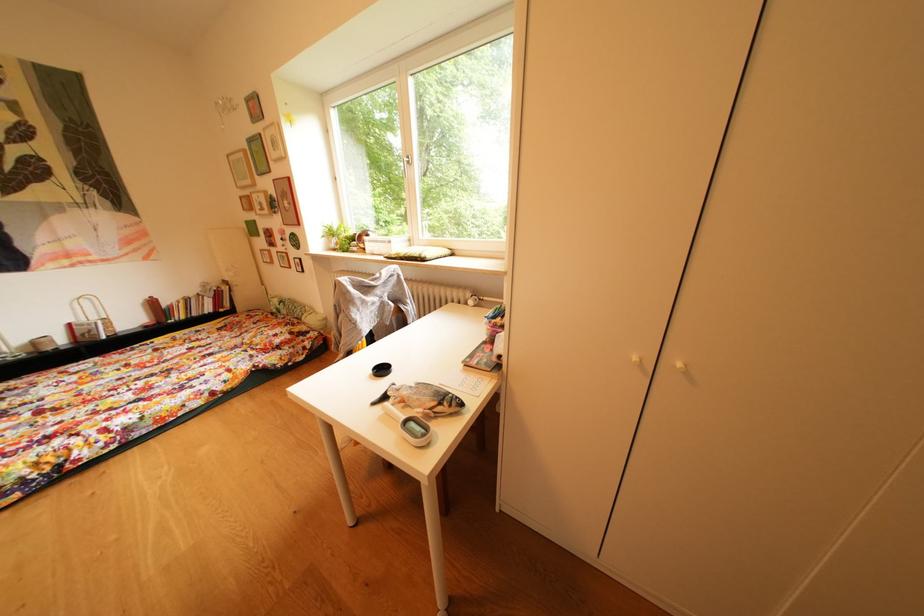
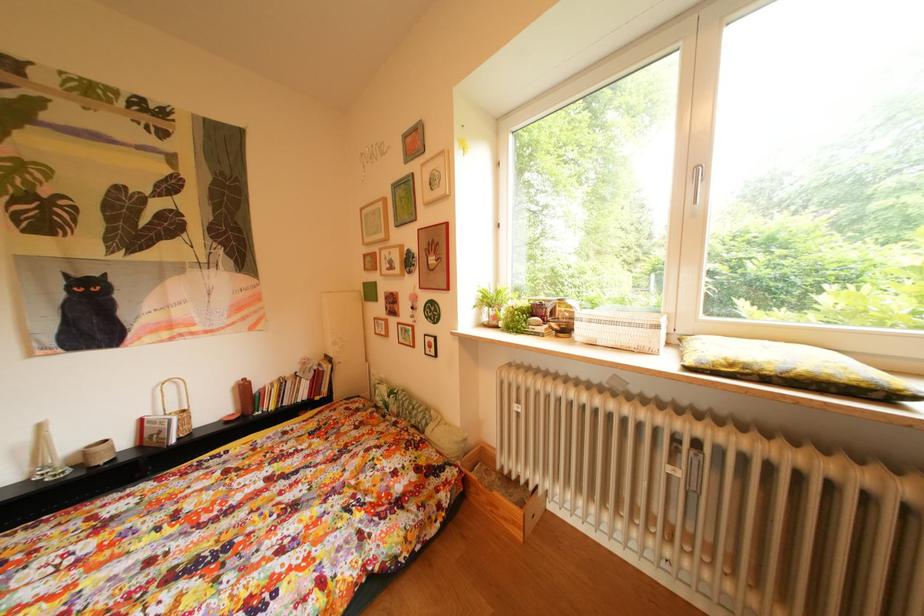
In a continuous first-person perspective shot, in which direction is the camera moving?

The movement direction of the cameraman is left, forward.